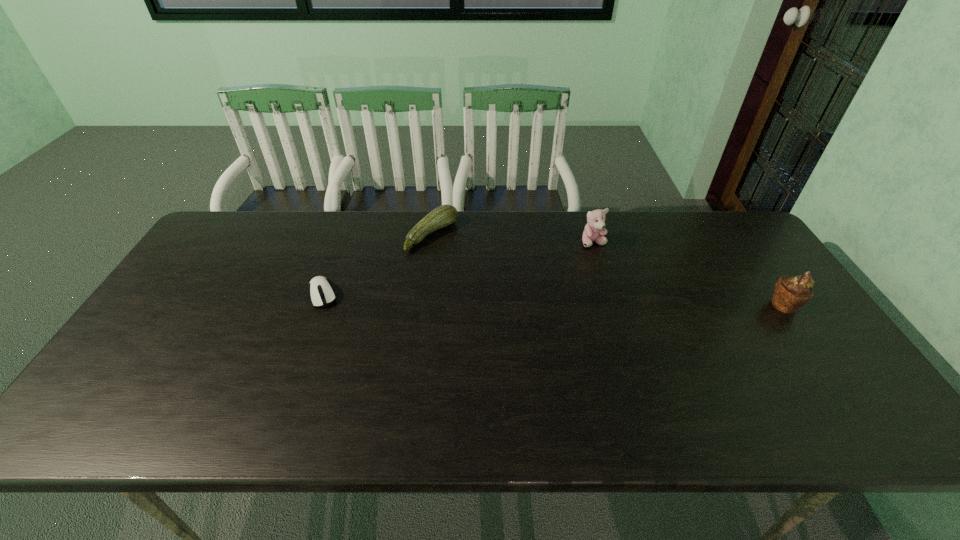
Locate an element on the screen. free space between the rightmost object and the teddy bear is located at coordinates (689, 274).

Where is `vacant space that is in between the zucchini and the second object from right to left`? This screenshot has height=540, width=960. vacant space that is in between the zucchini and the second object from right to left is located at coordinates (513, 239).

The width and height of the screenshot is (960, 540). In order to click on vacant point located between the third object from left to right and the muffin in this screenshot , I will do `click(689, 274)`.

Where is `vacant area that lies between the mouse and the second object from right to left`? The height and width of the screenshot is (540, 960). vacant area that lies between the mouse and the second object from right to left is located at coordinates (458, 268).

Where is `object that is the third closest to the third tallest object`? Image resolution: width=960 pixels, height=540 pixels. object that is the third closest to the third tallest object is located at coordinates (791, 293).

Identify which object is the second closest to the zucchini. Please provide its 2D coordinates. Your answer should be formatted as a tuple, i.e. [(x, y)], where the tuple contains the x and y coordinates of a point satisfying the conditions above.

[(594, 230)]

Identify the location of vacant space that satisfies the following two spatial constraints: 1. on the front side of the leftmost object; 2. on the right side of the muffin. [x=319, y=305].

I want to click on free space in the image that satisfies the following two spatial constraints: 1. on the front side of the second object from right to left; 2. on the left side of the rightmost object, so click(612, 305).

This screenshot has width=960, height=540. I want to click on free space in the image that satisfies the following two spatial constraints: 1. on the front side of the teddy bear; 2. on the right side of the muffin, so tap(612, 305).